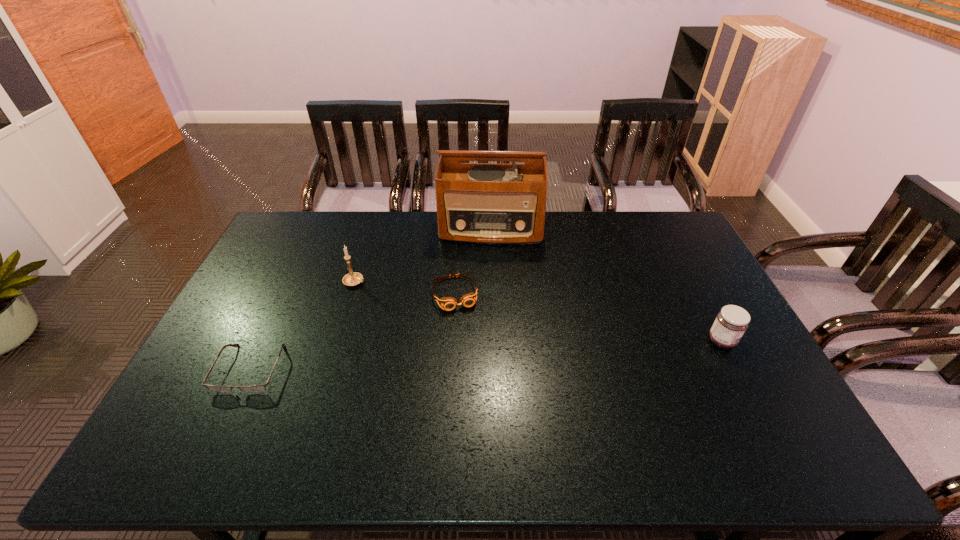
Locate an element on the screen. free space located on the front panel of the radio receiver is located at coordinates (485, 322).

In order to click on free space located on the front panel of the radio receiver in this screenshot , I will do `click(487, 284)`.

In order to click on blank space located on the handle side of the candle holder in this screenshot , I will do `click(387, 294)`.

Identify the location of vacant region located 0.370m on the handle side of the candle holder. (463, 325).

Identify the location of vacant space located 0.100m on the handle side of the candle holder. (390, 295).

Locate an element on the screen. Image resolution: width=960 pixels, height=540 pixels. vacant space located 0.120m with the lenses facing forward on the fourth tallest object is located at coordinates (468, 342).

Find the location of `vacant space located 0.360m with the lenses facing forward on the fourth tallest object`. vacant space located 0.360m with the lenses facing forward on the fourth tallest object is located at coordinates (491, 415).

This screenshot has height=540, width=960. Find the location of `vacant space situated with the lenses facing forward on the fourth tallest object`. vacant space situated with the lenses facing forward on the fourth tallest object is located at coordinates (492, 418).

The image size is (960, 540). In order to click on object that is at the far edge in this screenshot , I will do `click(485, 203)`.

Where is `object at the near edge`? The width and height of the screenshot is (960, 540). object at the near edge is located at coordinates (252, 388).